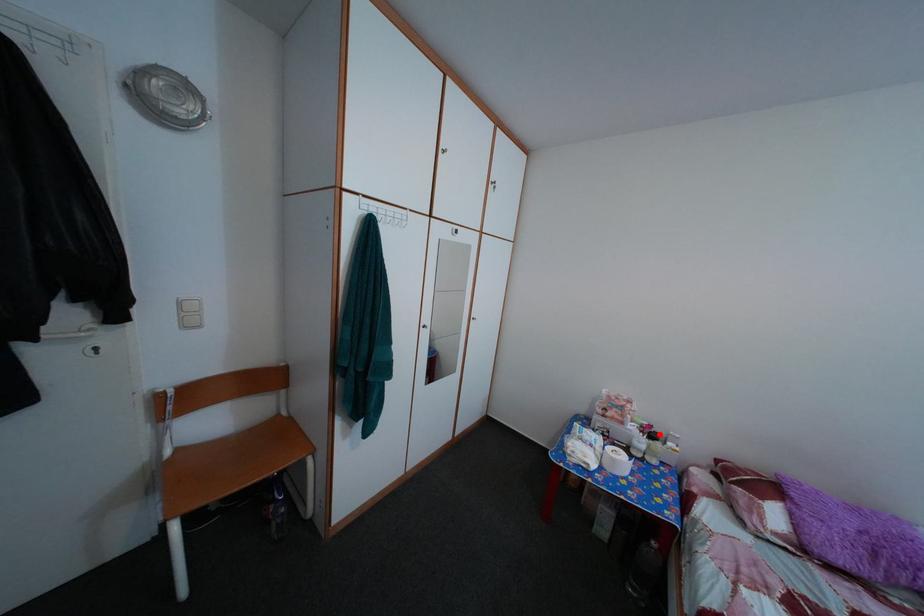
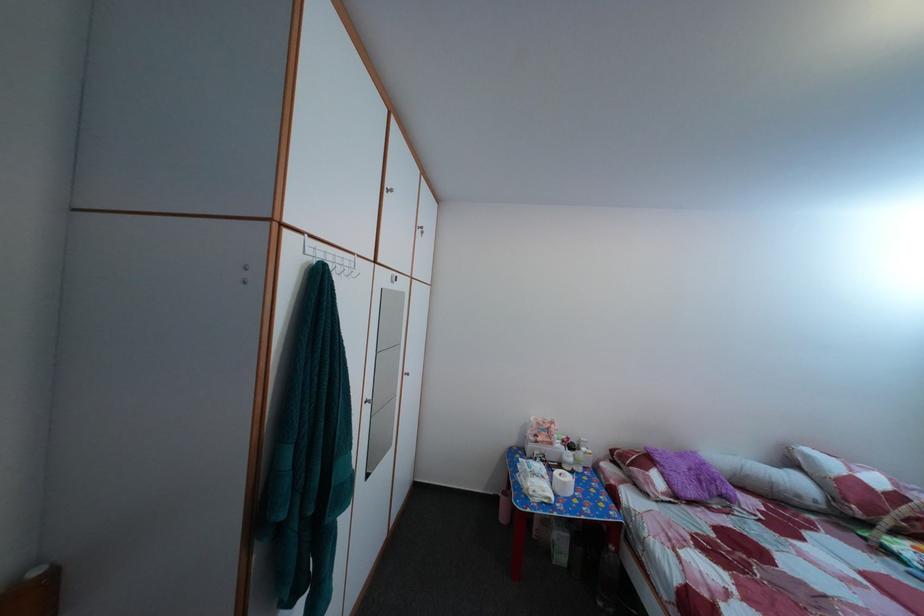
Find the pixel in the second image that matches the highlighted location in the first image.

(578, 447)